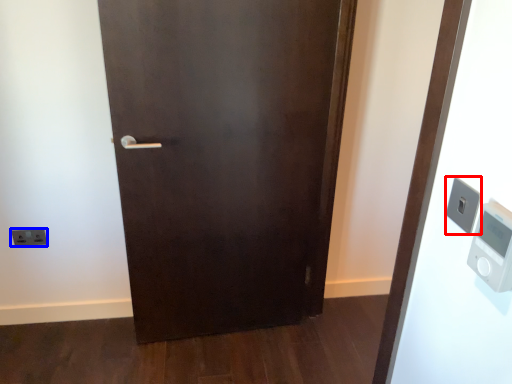
Question: Which of the following is the closest to the observer, light switch (highlighted by a red box) or light switch (highlighted by a blue box)?

Choices:
 (A) light switch
 (B) light switch

Answer: (A)